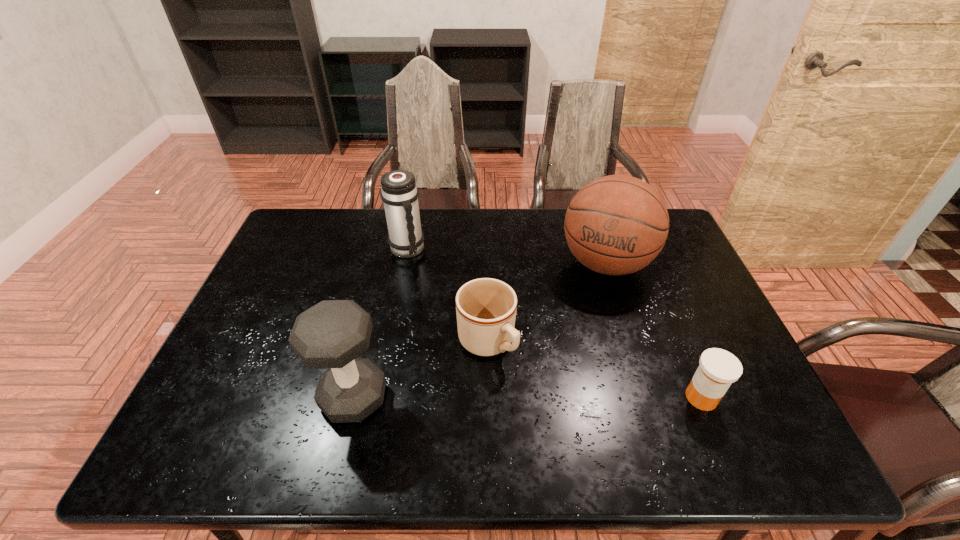
You are a GUI agent. You are given a task and a screenshot of the screen. Output one action in this format:
    pyautogui.click(x=<x>, y=<y>)
    Task: Click on the dumbbell
    The image size is (960, 540).
    Given the screenshot: What is the action you would take?
    pyautogui.click(x=331, y=334)

Find the location of `medicine`. medicine is located at coordinates (718, 369).

Where is `thermos bottle`? The height and width of the screenshot is (540, 960). thermos bottle is located at coordinates (399, 192).

This screenshot has width=960, height=540. Find the location of `the third nearest object`. the third nearest object is located at coordinates (486, 308).

This screenshot has height=540, width=960. I want to click on the third object from left to right, so click(x=486, y=308).

Locate an element on the screen. Image resolution: width=960 pixels, height=540 pixels. basketball is located at coordinates (615, 225).

Image resolution: width=960 pixels, height=540 pixels. I want to click on blank area located on the left of the dumbbell, so click(x=258, y=397).

Find the location of a particular element. Image resolution: width=960 pixels, height=540 pixels. free spot located 0.250m on the label of the medicine is located at coordinates (577, 397).

Locate an element on the screen. This screenshot has width=960, height=540. blank space located 0.230m on the label of the medicine is located at coordinates (586, 397).

The width and height of the screenshot is (960, 540). In order to click on vacant space located on the label of the medicine in this screenshot , I will do `click(521, 397)`.